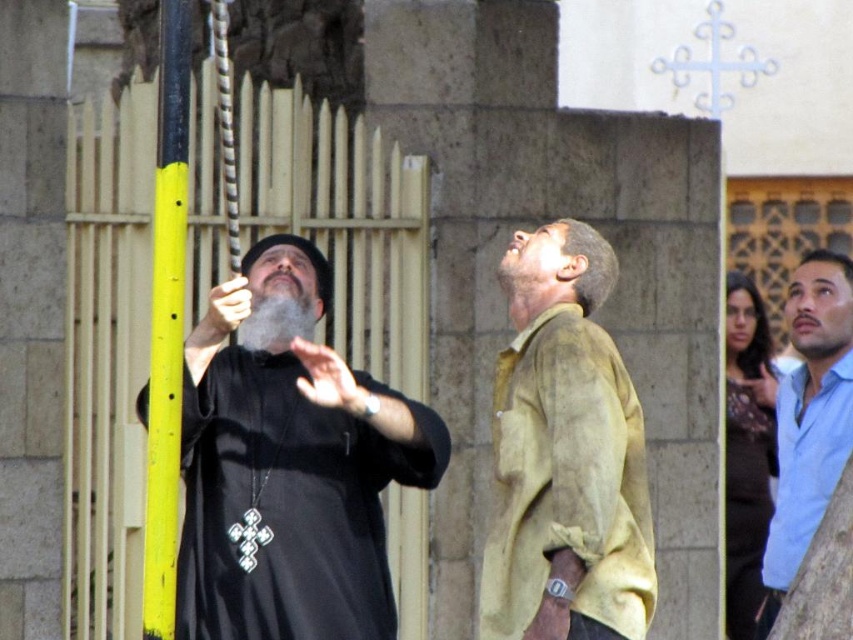
Question: Which point is closer to the camera taking this photo?

Choices:
 (A) (534, 355)
 (B) (264, 355)

Answer: (A)

Question: Is yellow painted metal pole at left behind blue cotton shirt at right?

Choices:
 (A) yes
 (B) no

Answer: (B)

Question: Considering the real-world distances, which object is farthest from the yellow painted metal pole at left?

Choices:
 (A) black matte robe at left
 (B) gray matte beard at center
 (C) black matte robe at right

Answer: (C)

Question: Which of the following is the closest to the observer?

Choices:
 (A) blue cotton shirt at right
 (B) gray matte beard at center
 (C) yellow painted metal pole at left
 (D) black matte robe at left

Answer: (C)

Question: Observing the image, what is the correct spatial positioning of light brown leather shirt at center in reference to black matte robe at right?

Choices:
 (A) right
 (B) left

Answer: (B)

Question: Can you confirm if black matte robe at right is smaller than gray matte beard at center?

Choices:
 (A) yes
 (B) no

Answer: (B)